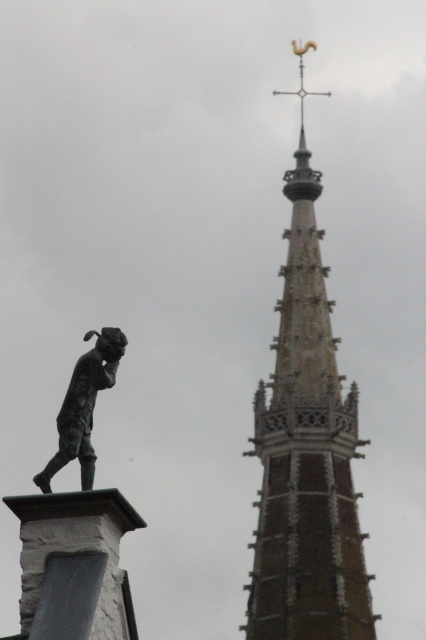
You are an architect analyzing the spatial relationship between the brown stone spire at upper center and the bronze statue at left. Based on their widths, which one would require more horizontal space if they were to be placed side by side?

The brown stone spire at upper center requires more horizontal space because its width surpasses that of the bronze statue at left.